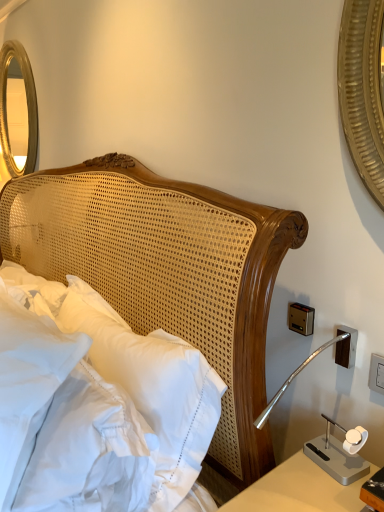
Question: Does white soft pillow at left come behind white woven headboard at center?

Choices:
 (A) no
 (B) yes

Answer: (A)

Question: Can you confirm if white soft pillow at left is taller than white woven headboard at center?

Choices:
 (A) yes
 (B) no

Answer: (B)

Question: From a real-world perspective, is white soft pillow at left beneath white woven headboard at center?

Choices:
 (A) no
 (B) yes

Answer: (A)

Question: Is white soft pillow at left positioned with its back to white woven headboard at center?

Choices:
 (A) yes
 (B) no

Answer: (A)

Question: Does white soft pillow at left appear on the left side of white woven headboard at center?

Choices:
 (A) yes
 (B) no

Answer: (A)

Question: From the image's perspective, would you say white soft pillow at left is shown under white woven headboard at center?

Choices:
 (A) no
 (B) yes

Answer: (A)

Question: From the image's perspective, is white plastic electric outlet at right located above white woven headboard at center?

Choices:
 (A) yes
 (B) no

Answer: (A)

Question: Could white woven headboard at center be considered to be inside white plastic electric outlet at right?

Choices:
 (A) no
 (B) yes

Answer: (A)

Question: From a real-world perspective, is white plastic electric outlet at right on white woven headboard at center?

Choices:
 (A) yes
 (B) no

Answer: (A)

Question: Considering the relative positions of white plastic electric outlet at right and white woven headboard at center in the image provided, is white plastic electric outlet at right to the right of white woven headboard at center from the viewer's perspective?

Choices:
 (A) yes
 (B) no

Answer: (A)

Question: Can you confirm if white plastic electric outlet at right is wider than white woven headboard at center?

Choices:
 (A) yes
 (B) no

Answer: (B)

Question: From a real-world perspective, is white plastic electric outlet at right below white woven headboard at center?

Choices:
 (A) no
 (B) yes

Answer: (A)

Question: Could you tell me if white woven headboard at center is turned towards white plastic electric outlet at right?

Choices:
 (A) no
 (B) yes

Answer: (A)